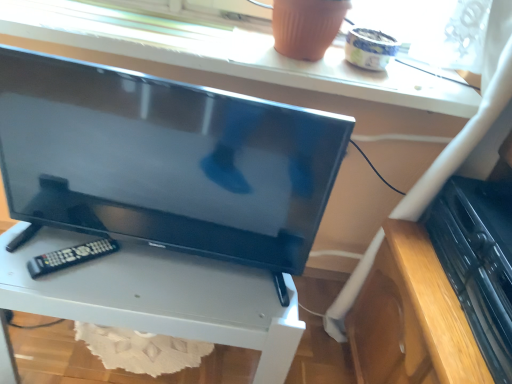
Question: Considering the relative sizes of matte white window sill at upper center and matte black tv at center in the image provided, is matte white window sill at upper center taller than matte black tv at center?

Choices:
 (A) no
 (B) yes

Answer: (A)

Question: Is matte black tv at center at the back of matte white window sill at upper center?

Choices:
 (A) no
 (B) yes

Answer: (A)

Question: Is matte white window sill at upper center in front of matte black tv at center?

Choices:
 (A) no
 (B) yes

Answer: (A)

Question: Is matte white window sill at upper center with matte black tv at center?

Choices:
 (A) yes
 (B) no

Answer: (B)

Question: From the image's perspective, would you say matte white window sill at upper center is positioned over matte black tv at center?

Choices:
 (A) no
 (B) yes

Answer: (B)

Question: Is matte white window sill at upper center to the right of matte black tv at center from the viewer's perspective?

Choices:
 (A) yes
 (B) no

Answer: (A)

Question: Is matte black tv at center shorter than white glossy tv stand at center?

Choices:
 (A) yes
 (B) no

Answer: (A)

Question: Is matte black tv at center at the right side of white glossy tv stand at center?

Choices:
 (A) no
 (B) yes

Answer: (B)

Question: From a real-world perspective, does matte black tv at center sit lower than white glossy tv stand at center?

Choices:
 (A) no
 (B) yes

Answer: (A)

Question: Considering the relative sizes of matte black tv at center and white glossy tv stand at center in the image provided, is matte black tv at center thinner than white glossy tv stand at center?

Choices:
 (A) yes
 (B) no

Answer: (A)

Question: From the image's perspective, does matte black tv at center appear lower than white glossy tv stand at center?

Choices:
 (A) no
 (B) yes

Answer: (A)

Question: Could you tell me if matte black tv at center is facing white glossy tv stand at center?

Choices:
 (A) yes
 (B) no

Answer: (B)

Question: From the image's perspective, is white glossy tv stand at center located beneath black plastic remote at lower left?

Choices:
 (A) yes
 (B) no

Answer: (A)